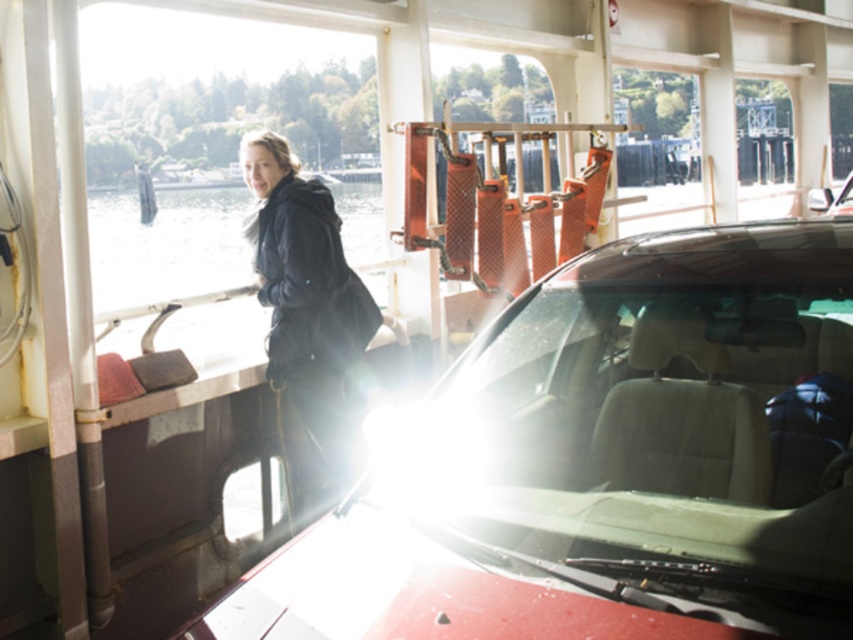
You are a passenger on the ferry and want to see the view outside without the glare from the car. Which object should you move closer to, the transparent glass windshield at center or the black matte jacket at left?

The transparent glass windshield at center is to the right of the black matte jacket at left. To avoid the glare from the car, you should move closer to the black matte jacket at left, which is positioned away from the bright area.

You are standing inside the ferry and want to see the view outside through the transparent glass windshield at center without blocking your view with the black matte jacket at left. Which object should you move closer to?

You should move closer to the transparent glass windshield at center because it is closer to the viewer than the black matte jacket at left, allowing you to position yourself between the jacket and the windshield for an unobstructed view.

From the picture: You are a delivery robot with a width of 1.5 meters. You need to move from the transparent glass windshield at center to the black matte jacket at left. Is there enough space for you to pass through the gap between them?

The distance between the transparent glass windshield at center and the black matte jacket at left is 1.94 meters, so yes, the robot can pass through the gap since its width of 1.5 meters is less than the available space.